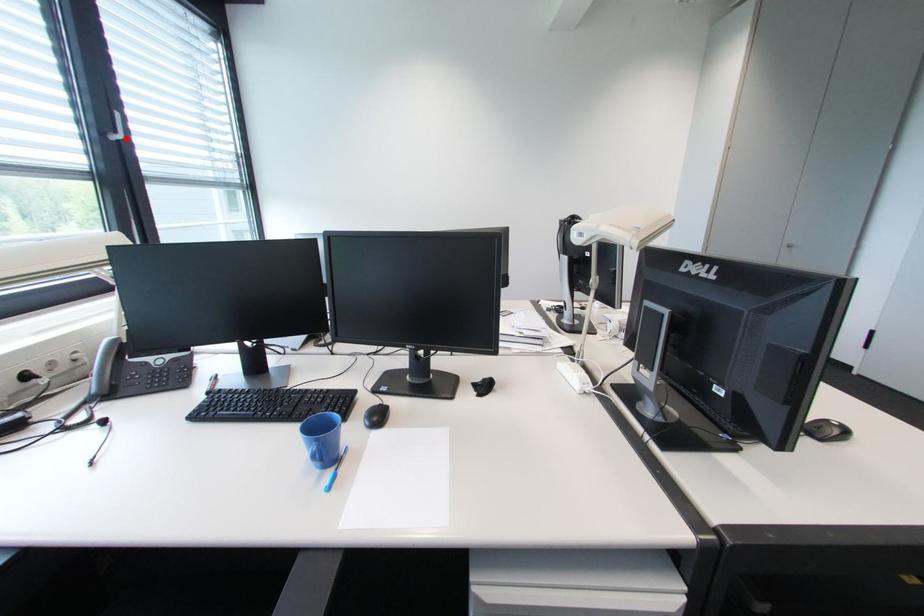
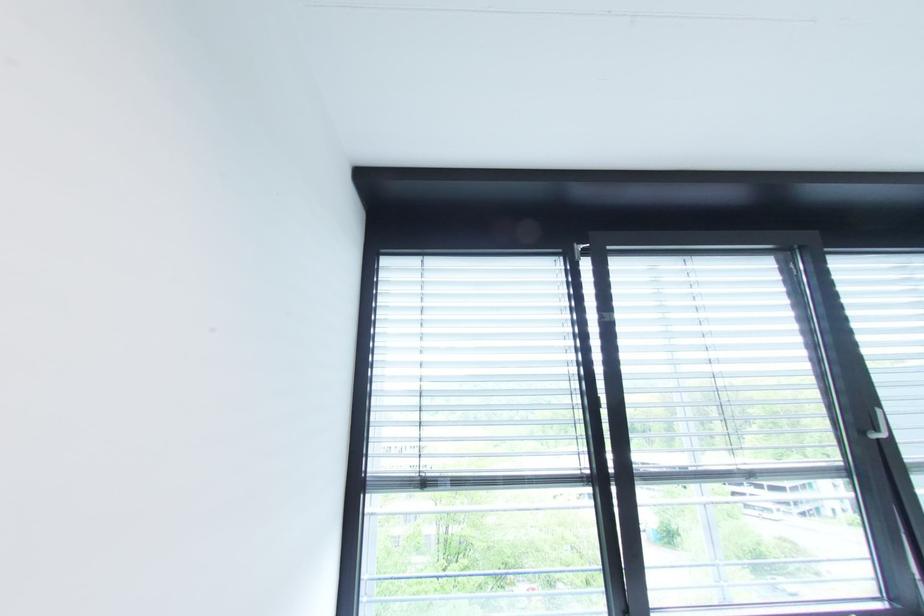
The point at the highlighted location is marked in the first image. Where is the corresponding point in the second image?

(889, 437)